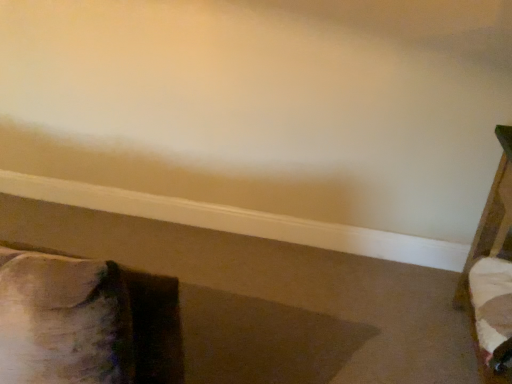
This screenshot has width=512, height=384. In order to click on white fabric chair at right in this screenshot , I will do `click(492, 270)`.

The width and height of the screenshot is (512, 384). Describe the element at coordinates (492, 270) in the screenshot. I see `white fabric chair at right` at that location.

Where is `white fabric chair at right`? The image size is (512, 384). white fabric chair at right is located at coordinates (492, 270).